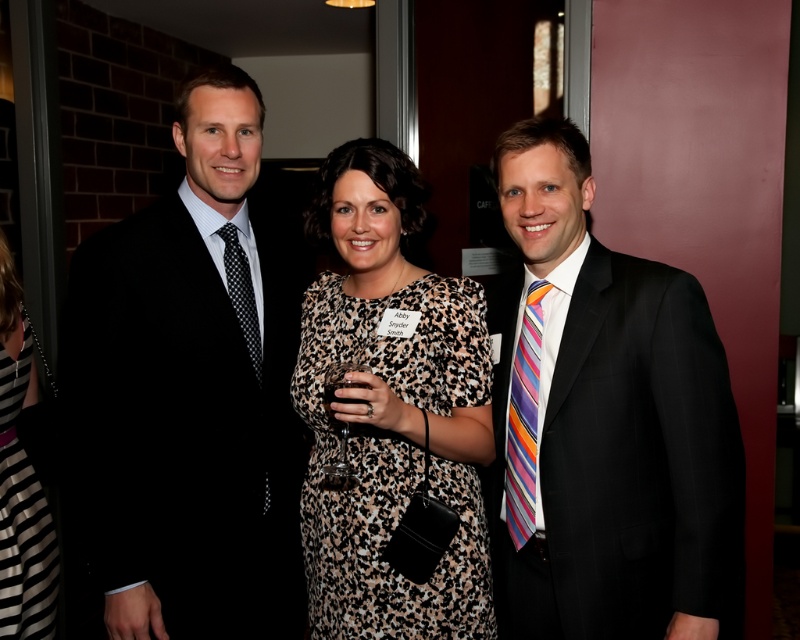
How distant is black pinstripe suit at right from black and white striped dress at lower left?

black pinstripe suit at right and black and white striped dress at lower left are 1.36 meters apart.

Locate an element on the screen. Image resolution: width=800 pixels, height=640 pixels. black pinstripe suit at right is located at coordinates (606, 426).

Who is more forward, [586,202] or [510,401]?

Point [586,202] is in front.

Does point (620, 627) lie behind point (516, 440)?

No, (620, 627) is closer to viewer.

Identify the location of black pinstripe suit at right. (606, 426).

Does black and white striped dress at lower left come behind striped silk tie at right?

That is True.

Is point (38, 522) positioned before point (532, 316)?

No, it is not.

Locate an element on the screen. black and white striped dress at lower left is located at coordinates (22, 515).